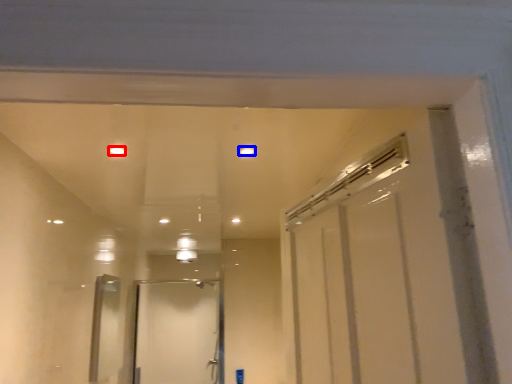
Question: Which point is closer to the camera, light (highlighted by a red box) or light (highlighted by a blue box)?

Choices:
 (A) light
 (B) light

Answer: (A)